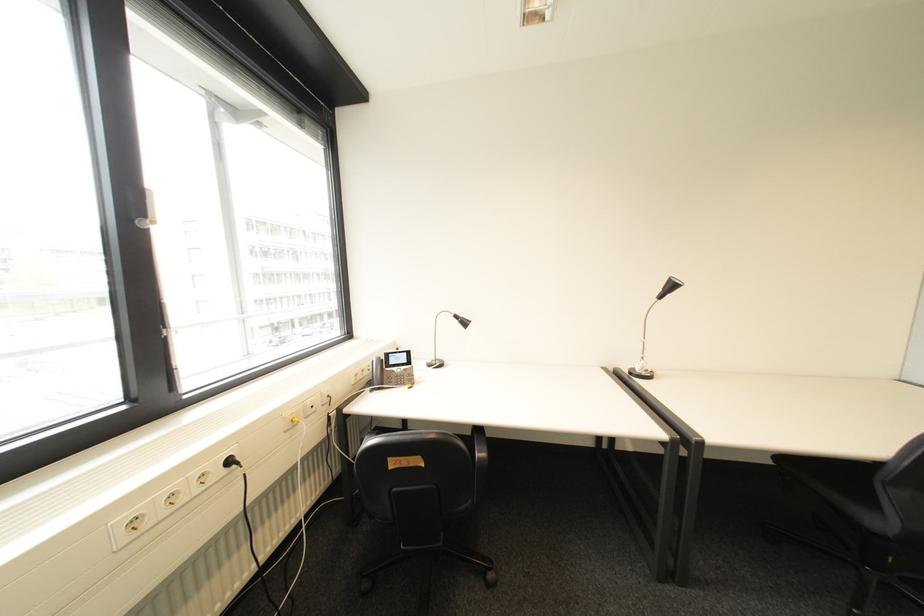
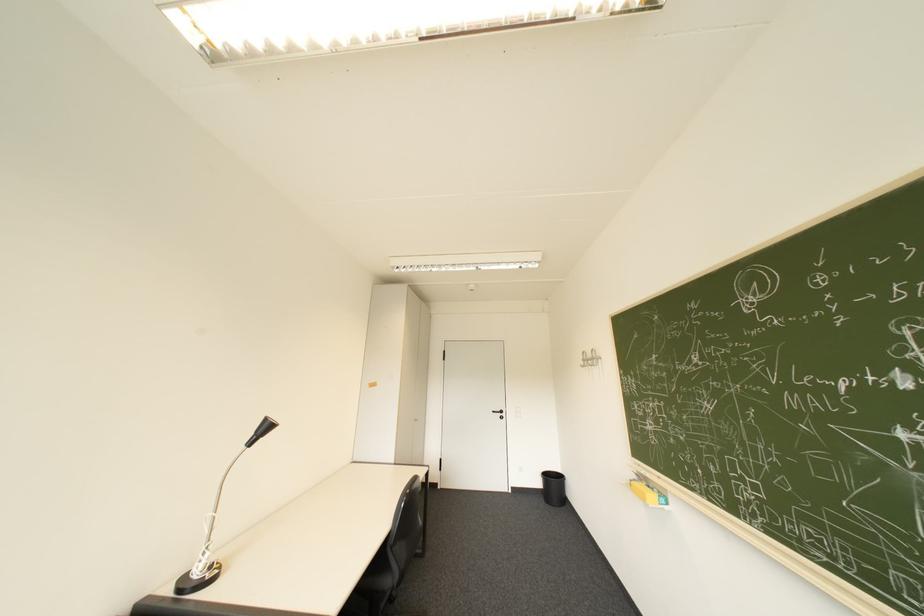
Locate, in the second image, the point that corresponds to [673,290] in the first image.

(266, 434)